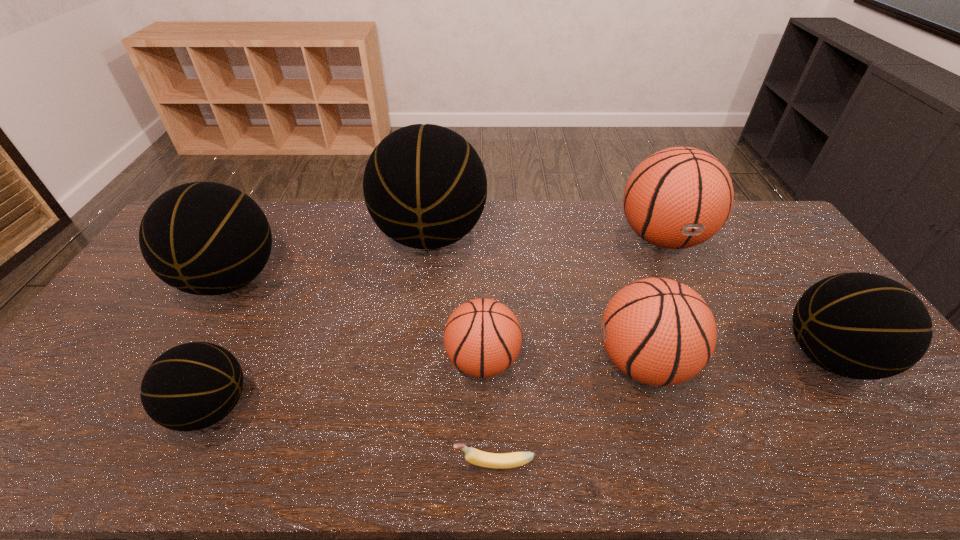
Find the location of a particular element. free area in between the second black basketball from right to left and the leftmost orange basketball is located at coordinates (457, 298).

Image resolution: width=960 pixels, height=540 pixels. What are the coordinates of `vacant space in between the shortest object and the second biggest black basketball` in the screenshot? It's located at (363, 372).

Find the location of a particular element. free spot between the tallest basketball and the second biggest black basketball is located at coordinates (331, 258).

Choose which object is the third nearest neighbor to the rightmost object. Please provide its 2D coordinates. Your answer should be formatted as a tuple, i.e. [(x, y)], where the tuple contains the x and y coordinates of a point satisfying the conditions above.

[(482, 337)]

This screenshot has height=540, width=960. Identify the location of the fifth closest object to the biggest black basketball. (679, 197).

Identify the location of the third closest basketball to the smallest black basketball. (482, 337).

Locate an element on the screen. This screenshot has width=960, height=540. basketball that is the fourth closest to the smallest black basketball is located at coordinates (657, 331).

Where is `black basketball identified as the second closest to the smallest black basketball`? This screenshot has width=960, height=540. black basketball identified as the second closest to the smallest black basketball is located at coordinates (425, 186).

Where is `the third closest black basketball to the smallest black basketball`? the third closest black basketball to the smallest black basketball is located at coordinates (864, 326).

This screenshot has height=540, width=960. Find the location of `orange basketball that can be found as the closest to the third smallest black basketball`. orange basketball that can be found as the closest to the third smallest black basketball is located at coordinates (482, 337).